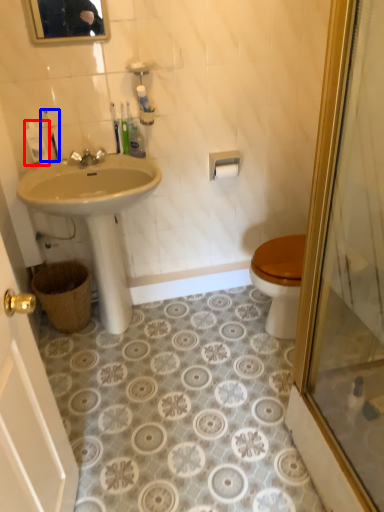
Question: Which point is closer to the camera, toiletry (highlighted by a red box) or toiletry (highlighted by a blue box)?

Choices:
 (A) toiletry
 (B) toiletry

Answer: (B)